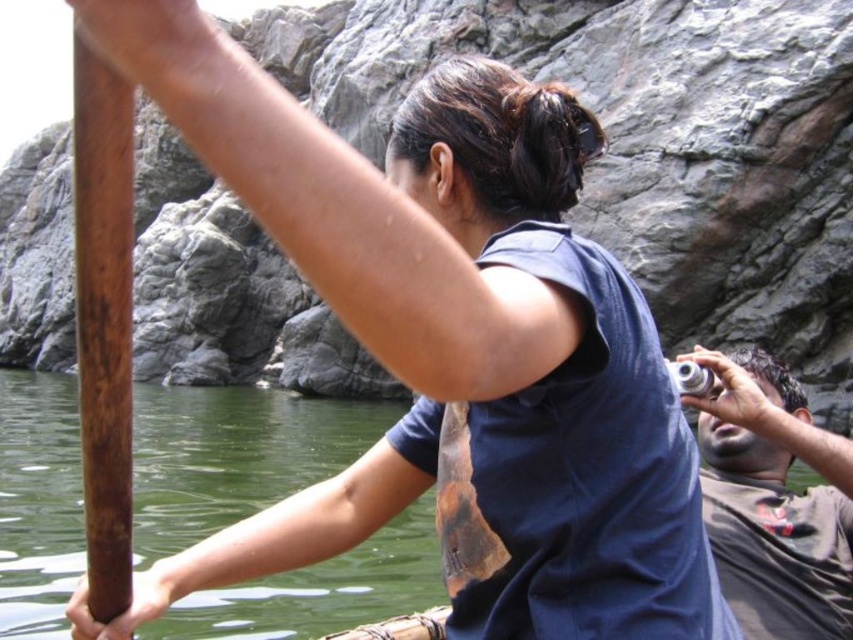
Question: Is dark brown leather camera at right in front of brown wooden pole at left?

Choices:
 (A) yes
 (B) no

Answer: (B)

Question: Is dark brown leather camera at right below brown wooden pole at left?

Choices:
 (A) yes
 (B) no

Answer: (A)

Question: Which point appears closest to the camera in this image?

Choices:
 (A) (809, 524)
 (B) (119, 369)

Answer: (B)

Question: Is dark brown leather camera at right smaller than brown wooden pole at left?

Choices:
 (A) yes
 (B) no

Answer: (A)